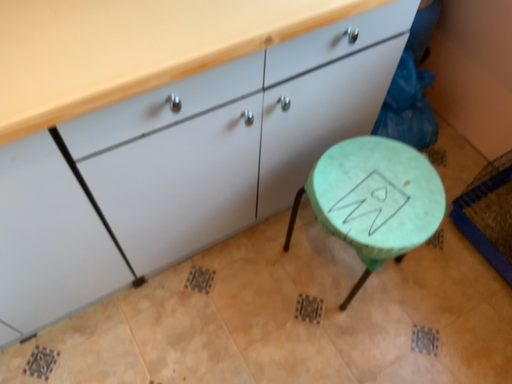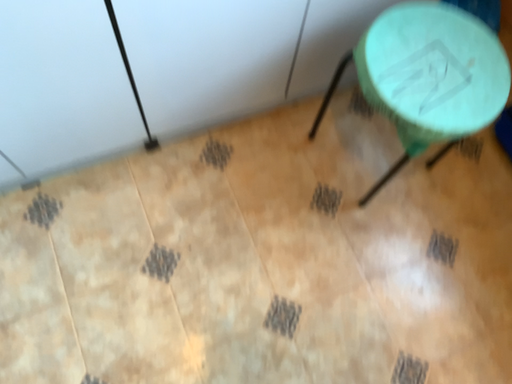
Question: How did the camera likely rotate when shooting the video?

Choices:
 (A) rotated upward
 (B) rotated downward

Answer: (B)